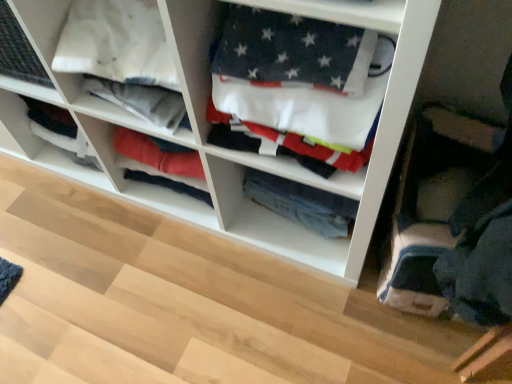
Question: Can you confirm if white fabric at center is thinner than denim jeans at center, arranged as the 1th clothing when viewed from the back?

Choices:
 (A) yes
 (B) no

Answer: (B)

Question: Is white fabric at center aimed at denim jeans at center, arranged as the 1th clothing when viewed from the back?

Choices:
 (A) yes
 (B) no

Answer: (A)

Question: Is white fabric at center to the right of denim jeans at center, the second clothing in the front-to-back sequence, from the viewer's perspective?

Choices:
 (A) no
 (B) yes

Answer: (A)

Question: Is white fabric at center oriented away from denim jeans at center, arranged as the 1th clothing when viewed from the back?

Choices:
 (A) yes
 (B) no

Answer: (A)

Question: Can you confirm if white fabric at center is smaller than denim jeans at center, the second clothing in the front-to-back sequence?

Choices:
 (A) yes
 (B) no

Answer: (B)

Question: Considering their positions, is white cotton flag at center, the 1th clothing in the front-to-back sequence, located in front of or behind denim jeans at center, the second clothing in the front-to-back sequence?

Choices:
 (A) behind
 (B) front

Answer: (B)

Question: Considering the positions of point pyautogui.click(x=357, y=105) and point pyautogui.click(x=322, y=223), is point pyautogui.click(x=357, y=105) closer or farther from the camera than point pyautogui.click(x=322, y=223)?

Choices:
 (A) farther
 (B) closer

Answer: (B)

Question: Is white cotton flag at center, the 1th clothing in the front-to-back sequence, taller or shorter than denim jeans at center, arranged as the 1th clothing when viewed from the back?

Choices:
 (A) short
 (B) tall

Answer: (B)

Question: Based on their sizes in the image, would you say white cotton flag at center, which is the 2th clothing in back-to-front order, is bigger or smaller than denim jeans at center, arranged as the 1th clothing when viewed from the back?

Choices:
 (A) big
 (B) small

Answer: (A)

Question: In the image, is denim jeans at center, the second clothing in the front-to-back sequence, on the left side or the right side of white fabric at center?

Choices:
 (A) right
 (B) left

Answer: (A)

Question: In the image, is denim jeans at center, the second clothing in the front-to-back sequence, positioned in front of or behind white fabric at center?

Choices:
 (A) behind
 (B) front

Answer: (A)

Question: Is denim jeans at center, the second clothing in the front-to-back sequence, bigger or smaller than white fabric at center?

Choices:
 (A) big
 (B) small

Answer: (B)

Question: Which is correct: denim jeans at center, arranged as the 1th clothing when viewed from the back, is inside white fabric at center, or outside of it?

Choices:
 (A) outside
 (B) inside

Answer: (B)

Question: Is denim jeans at center, the second clothing in the front-to-back sequence, in front of or behind white cotton flag at center, which is the 2th clothing in back-to-front order, in the image?

Choices:
 (A) behind
 (B) front

Answer: (A)

Question: Is denim jeans at center, arranged as the 1th clothing when viewed from the back, wider or thinner than white cotton flag at center, which is the 2th clothing in back-to-front order?

Choices:
 (A) wide
 (B) thin

Answer: (B)